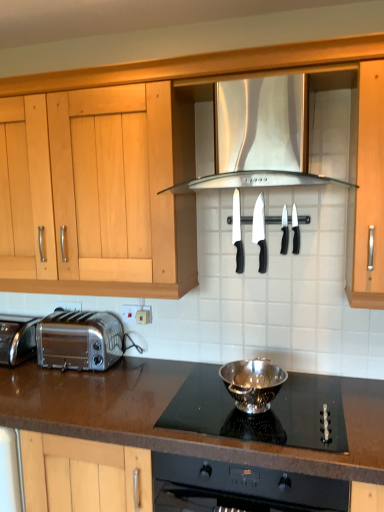
Question: Should I look upward or downward to see black plastic knife at center, positioned as the 1th kitchen appliance in back-to-front order?

Choices:
 (A) down
 (B) up

Answer: (B)

Question: From a real-world perspective, does white plastic electric outlet at lower center sit lower than polished chrome toaster at lower left?

Choices:
 (A) no
 (B) yes

Answer: (A)

Question: Is white plastic electric outlet at lower center far from polished chrome toaster at lower left?

Choices:
 (A) no
 (B) yes

Answer: (A)

Question: From the image's perspective, is white plastic electric outlet at lower center located above polished chrome toaster at lower left?

Choices:
 (A) no
 (B) yes

Answer: (B)

Question: Does white plastic electric outlet at lower center have a smaller size compared to polished chrome toaster at lower left?

Choices:
 (A) yes
 (B) no

Answer: (A)

Question: Is white plastic electric outlet at lower center next to polished chrome toaster at lower left?

Choices:
 (A) yes
 (B) no

Answer: (B)

Question: From a real-world perspective, is white plastic electric outlet at lower center on polished chrome toaster at lower left?

Choices:
 (A) yes
 (B) no

Answer: (A)

Question: From the image's perspective, would you say silver metallic bowl at center, the 5th kitchen appliance from the back, is shown under satin chrome toaster at lower left?

Choices:
 (A) no
 (B) yes

Answer: (B)

Question: Does silver metallic bowl at center, the 1th kitchen appliance in the front-to-back sequence, have a greater width compared to satin chrome toaster at lower left?

Choices:
 (A) yes
 (B) no

Answer: (B)

Question: Is silver metallic bowl at center, the 1th kitchen appliance in the front-to-back sequence, to the left of satin chrome toaster at lower left from the viewer's perspective?

Choices:
 (A) yes
 (B) no

Answer: (B)

Question: Can you confirm if silver metallic bowl at center, the 5th kitchen appliance from the back, is bigger than satin chrome toaster at lower left?

Choices:
 (A) yes
 (B) no

Answer: (B)

Question: Is the position of silver metallic bowl at center, the 5th kitchen appliance from the back, less distant than that of satin chrome toaster at lower left?

Choices:
 (A) no
 (B) yes

Answer: (B)

Question: From the image's perspective, is silver metallic bowl at center, the 5th kitchen appliance from the back, located above black plastic knife at center, the 5th kitchen appliance from the front?

Choices:
 (A) no
 (B) yes

Answer: (A)